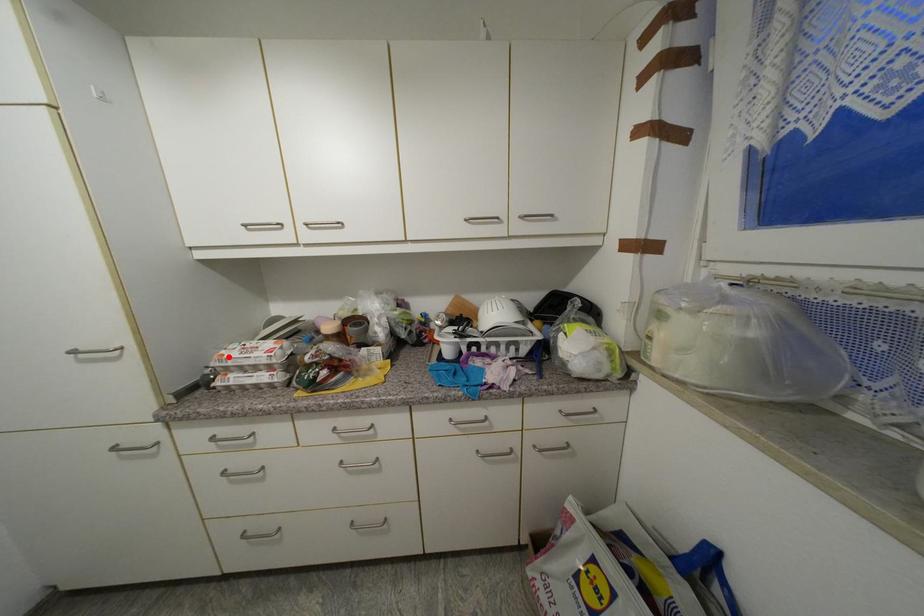
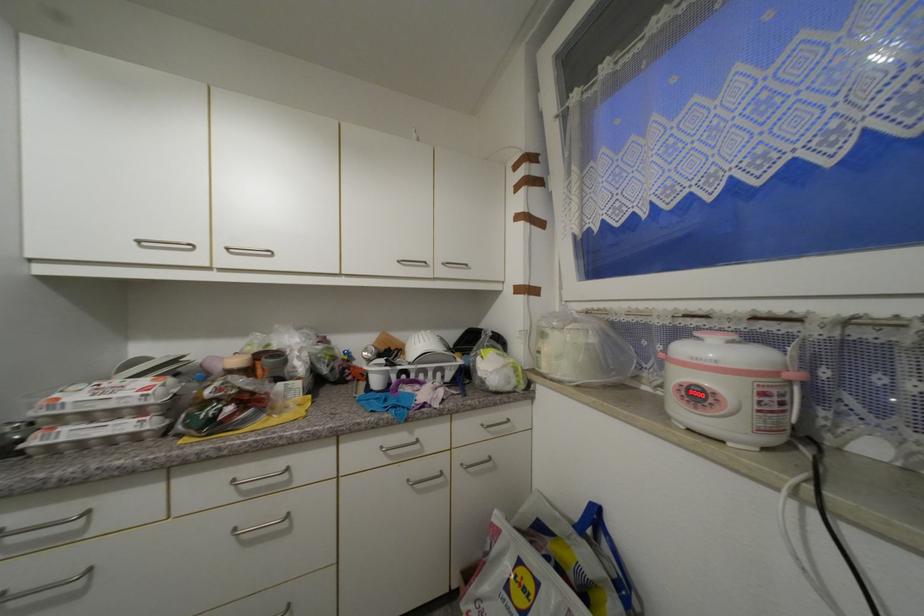
Where in the second image is the point corresponding to the highlighted location from the first image?

(64, 400)